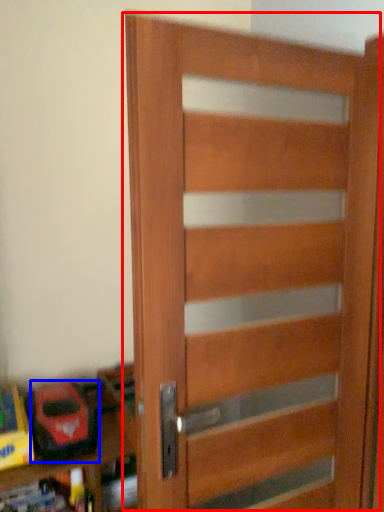
Question: Which object appears farthest to the camera in this image, door (highlighted by a red box) or toy (highlighted by a blue box)?

Choices:
 (A) door
 (B) toy

Answer: (B)